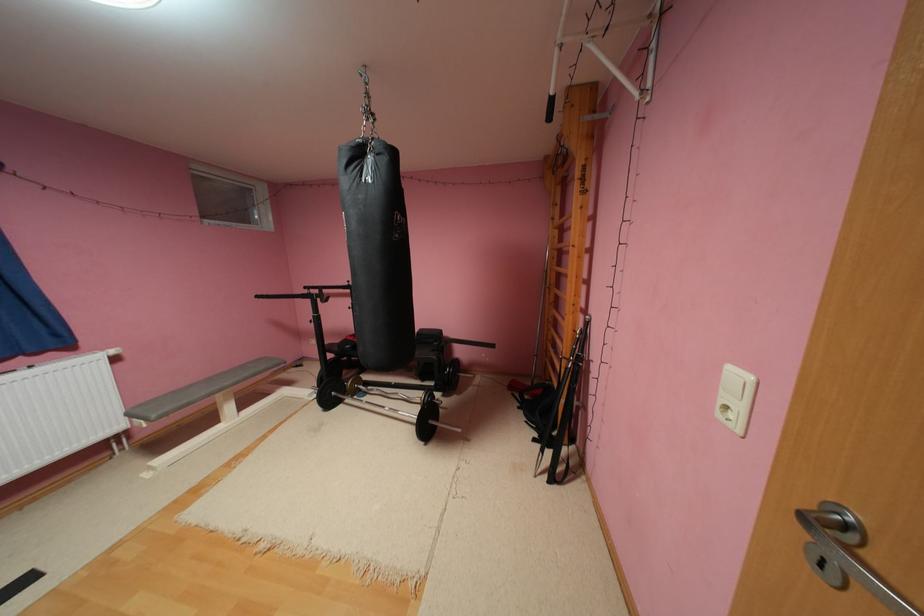
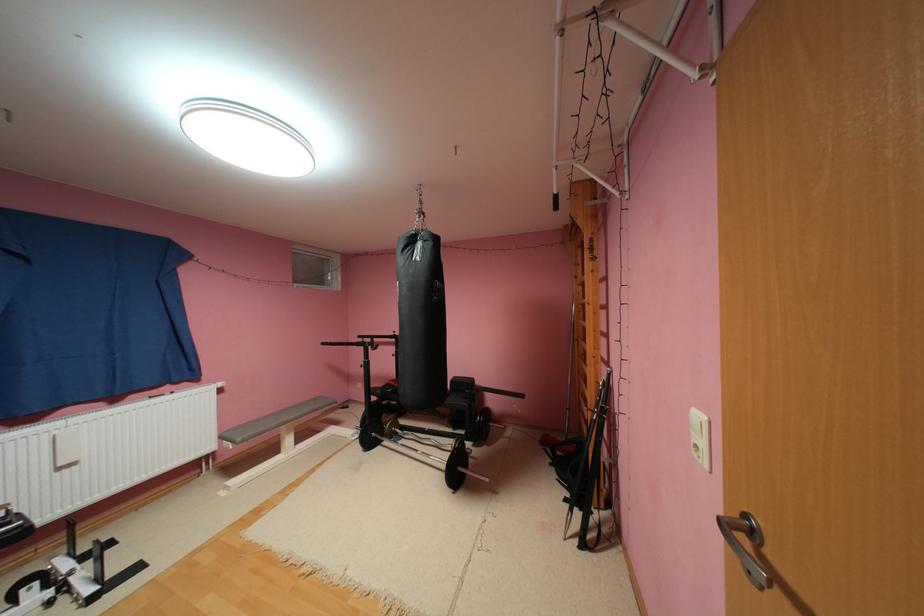
In the second image, find the point that corresponds to point (543, 440) in the first image.

(575, 500)